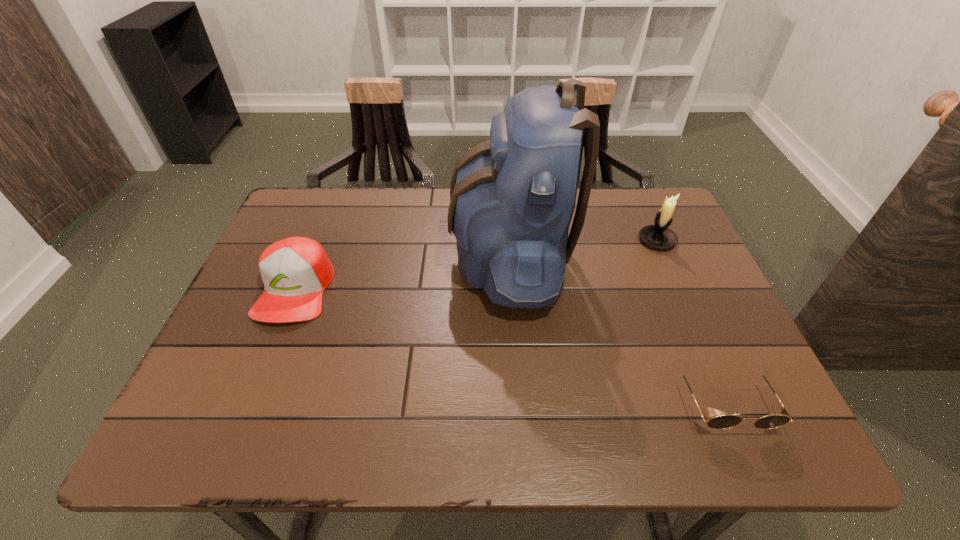
Where is `free point located 0.300m on the front of the second tallest object`? This screenshot has height=540, width=960. free point located 0.300m on the front of the second tallest object is located at coordinates pyautogui.click(x=703, y=345).

Find the location of `free space located on the front-facing side of the leftmost object`. free space located on the front-facing side of the leftmost object is located at coordinates (272, 346).

The width and height of the screenshot is (960, 540). Identify the location of backpack present at the far edge. (512, 198).

Identify the location of candle holder that is at the far edge. The image size is (960, 540). (x=659, y=236).

Locate an element on the screen. The height and width of the screenshot is (540, 960). object present at the near edge is located at coordinates (782, 417).

What are the coordinates of `object located at the left edge` in the screenshot? It's located at (295, 271).

I want to click on candle holder that is at the right edge, so click(659, 236).

This screenshot has height=540, width=960. In order to click on sunglasses present at the right edge in this screenshot , I will do `click(782, 417)`.

This screenshot has height=540, width=960. I want to click on object that is positioned at the far right corner, so (659, 236).

Find the location of a particular element. This screenshot has width=960, height=540. object positioned at the near right corner is located at coordinates (782, 417).